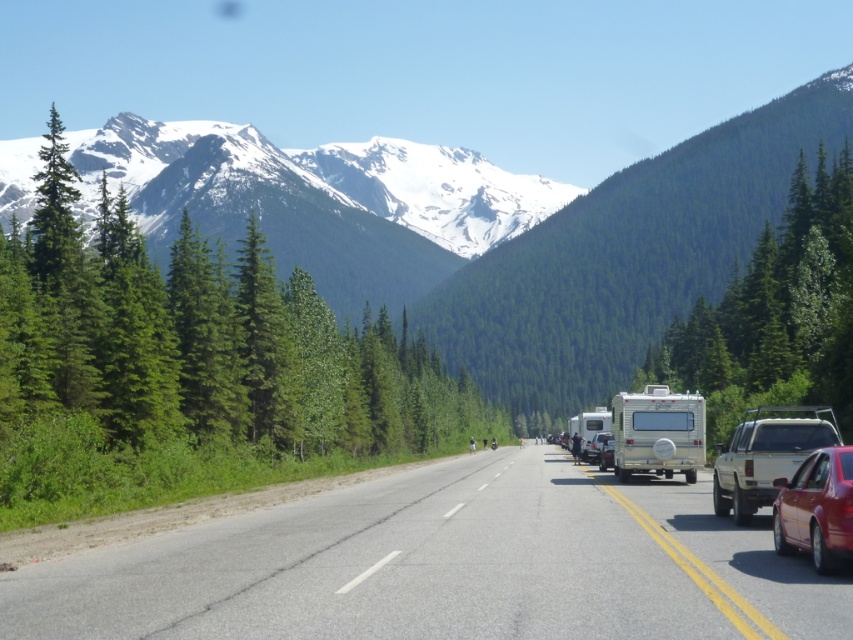
Is asphalt road at center below white matte camper van at right?

Indeed, asphalt road at center is positioned under white matte camper van at right.

Locate an element on the screen. This screenshot has height=640, width=853. asphalt road at center is located at coordinates (445, 566).

I want to click on white matte camper van at right, so click(x=766, y=456).

Does white matte camper van at right lie behind metallic silver car at center?

No, it is not.

Image resolution: width=853 pixels, height=640 pixels. What are the coordinates of `white matte camper van at right` in the screenshot? It's located at (766, 456).

You are a GUI agent. You are given a task and a screenshot of the screen. Output one action in this format:
    pyautogui.click(x=<x>, y=<y>)
    Task: Click on the white matte camper van at right
    
    Given the screenshot: What is the action you would take?
    pyautogui.click(x=766, y=456)

Measure the distance between point (817, 456) and camera.

Point (817, 456) and camera are 13.21 meters apart from each other.

Does shiny red sedan at lower right come behind metallic silver car at center-right?

No, shiny red sedan at lower right is closer to the viewer.

Who is more forward, (x=849, y=497) or (x=590, y=438)?

Point (x=849, y=497)

At what (x,y) coordinates should I click in order to perform the action: click on shiny red sedan at lower right. Please return your answer as a coordinate pair (x, y). The width and height of the screenshot is (853, 640). Looking at the image, I should click on (816, 508).